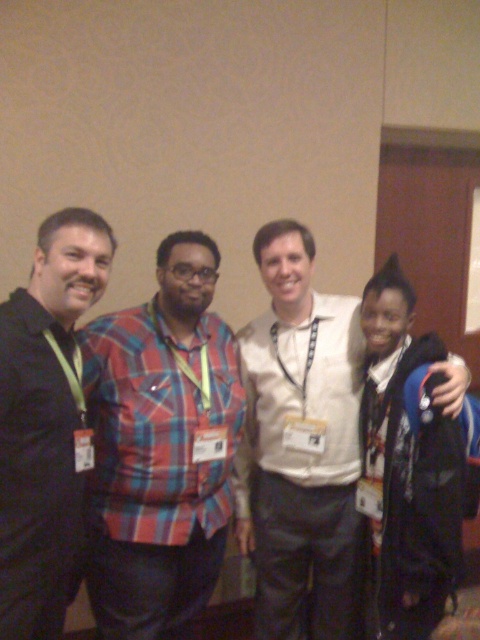
Question: Which point is farther to the camera?

Choices:
 (A) dark blue jacket at left
 (B) black fuzzy hat at right
 (C) white matte shirt at center

Answer: (B)

Question: Which point is closer to the camera?

Choices:
 (A) (420, 582)
 (B) (244, 541)
 (C) (96, 260)
 (D) (236, 364)

Answer: (C)

Question: Which point is farther to the camera?

Choices:
 (A) (40, 435)
 (B) (274, 547)
 (C) (101, 392)
 (D) (372, 534)

Answer: (B)

Question: Is plaid fabric shirt at center wider than white matte shirt at center?

Choices:
 (A) yes
 (B) no

Answer: (B)

Question: Is dark blue jacket at left positioned before black fuzzy hat at right?

Choices:
 (A) yes
 (B) no

Answer: (A)

Question: Is dark blue jacket at left to the right of black fuzzy hat at right from the viewer's perspective?

Choices:
 (A) yes
 (B) no

Answer: (B)